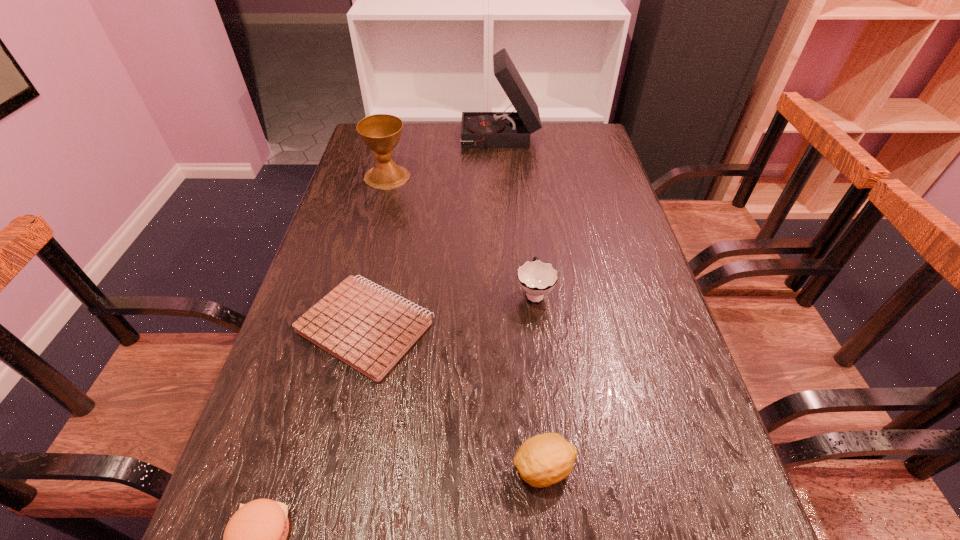
In order to click on notebook at the left edge in this screenshot , I will do (x=370, y=330).

In the image, there is a desktop. At what (x,y) coordinates should I click in order to perform the action: click on vacant space at the left edge. Please return your answer as a coordinate pair (x, y). Looking at the image, I should click on (331, 265).

This screenshot has width=960, height=540. In order to click on vacant space at the right edge of the desktop in this screenshot , I will do `click(608, 234)`.

In the image, there is a desktop. Where is `vacant space at the far left corner`? vacant space at the far left corner is located at coordinates (408, 137).

Identify the location of free space between the second nearest object and the shortest object. This screenshot has height=540, width=960. (455, 397).

This screenshot has width=960, height=540. Find the location of `vacant space that is in between the fifth farthest object and the cup`. vacant space that is in between the fifth farthest object and the cup is located at coordinates (539, 380).

This screenshot has height=540, width=960. I want to click on free space between the fifth shortest object and the shortest object, so click(376, 252).

Where is `free space between the tallest object and the fifth farthest object`? The image size is (960, 540). free space between the tallest object and the fifth farthest object is located at coordinates (522, 304).

At what (x,y) coordinates should I click in order to perform the action: click on empty location between the second nearest object and the phonograph_record. Please return your answer as a coordinate pair (x, y). The height and width of the screenshot is (540, 960). Looking at the image, I should click on (522, 304).

I want to click on vacant area that lies between the farthest object and the cup, so click(517, 216).